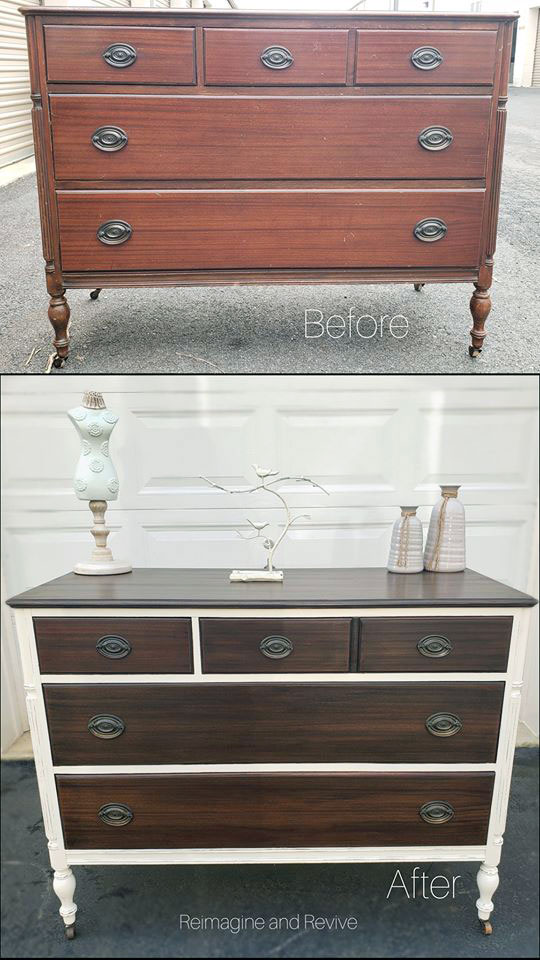
The image size is (540, 960). Identify the location of after middle drawer. (291, 750).